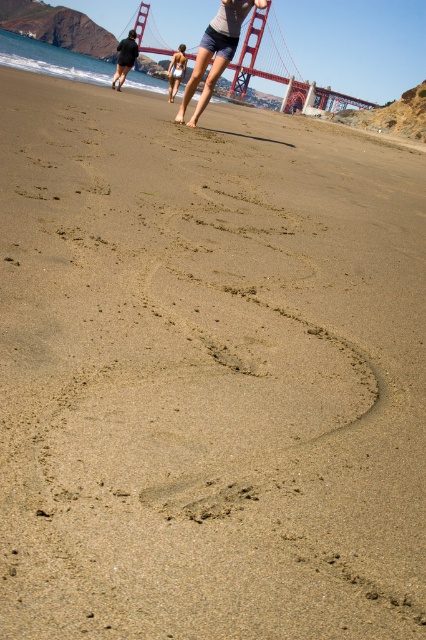
You are standing at the beach looking at the Golden Gate Bridge in the background. There are two points marked on the sand. Which point is closer to you, point (x=267, y=22) or point (x=132, y=36)?

Point (x=267, y=22) is closer to you because it is further to the viewer than point (x=132, y=36).

You are a photographer trying to capture the Golden Gate Bridge and the person in the white bikini in the same frame. Based on their positions, will the red painted steel golden gate bridge at upper center block the view of the white bikini at center?

The red painted steel golden gate bridge at upper center is in front of the white bikini at center, so it will block the view of the white bikini at center.

You are standing at the beach looking towards the Golden Gate Bridge. There are two points marked on the sand. The first point is at coordinates point [187,99] and the second point is at coordinates point [131,51]. Which point is closer to you?

Point [187,99] is closer to the viewer than point [131,51].